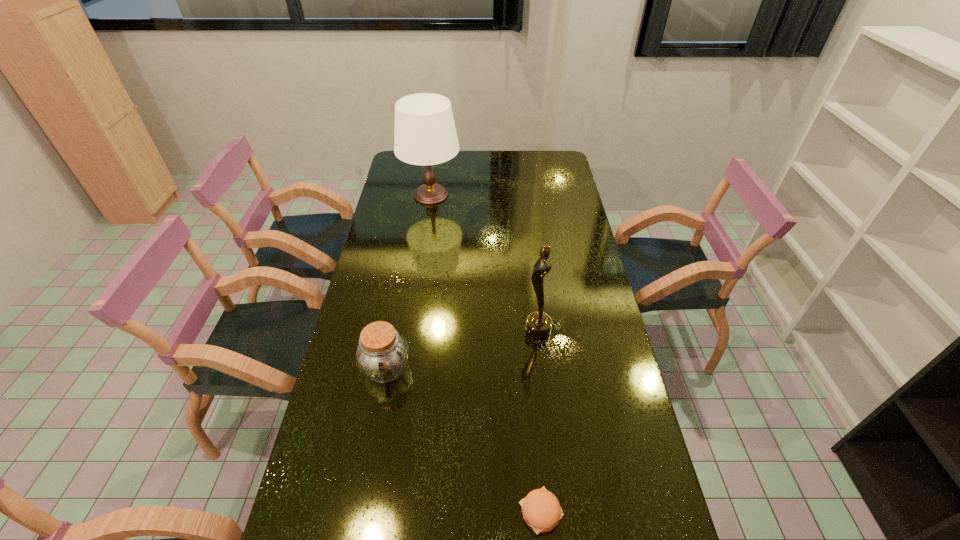
Find the location of a particular element. This screenshot has height=540, width=960. free space located 0.220m on the front-facing side of the second farthest object is located at coordinates (456, 331).

Identify the location of vacant space located on the front-facing side of the second farthest object. This screenshot has height=540, width=960. click(x=474, y=331).

Locate an element on the screen. The width and height of the screenshot is (960, 540). free space located 0.170m on the right of the second nearest object is located at coordinates (469, 369).

Where is `vacant space located on the right of the patty`? The width and height of the screenshot is (960, 540). vacant space located on the right of the patty is located at coordinates (641, 511).

At what (x,y) coordinates should I click in order to perform the action: click on lamp that is at the left edge. Please return your answer as a coordinate pair (x, y). The width and height of the screenshot is (960, 540). Looking at the image, I should click on (425, 134).

Locate an element on the screen. This screenshot has width=960, height=540. jar that is at the left edge is located at coordinates (382, 354).

Locate an element on the screen. free location at the far edge is located at coordinates (444, 176).

In the image, there is a desktop. Where is `vacant space at the left edge`? The height and width of the screenshot is (540, 960). vacant space at the left edge is located at coordinates (378, 420).

Where is `free spot at the right edge of the desktop`? free spot at the right edge of the desktop is located at coordinates tap(590, 353).

The image size is (960, 540). Find the location of `vacant area that lies between the third nearest object and the patty`. vacant area that lies between the third nearest object and the patty is located at coordinates (540, 421).